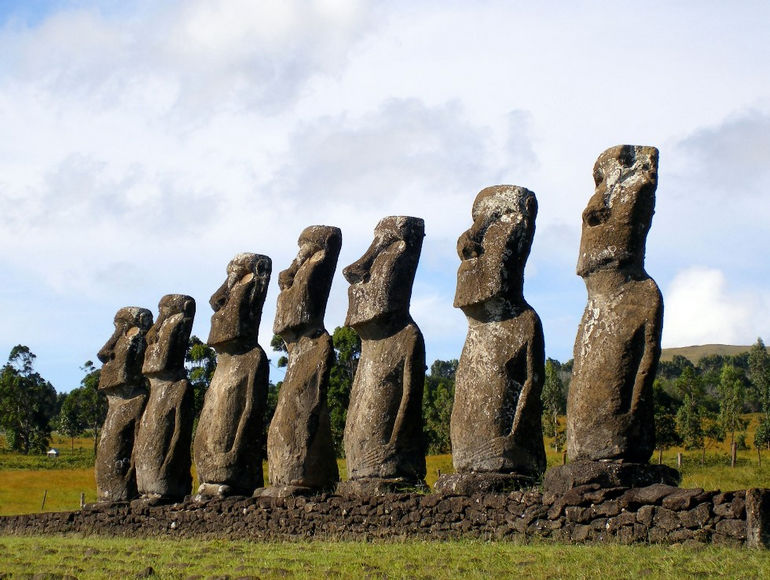
You are a GUI agent. You are given a task and a screenshot of the screen. Output one action in this format:
    pyautogui.click(x=<x>, y=<y>)
    Task: Click on the statue
    The image size is (770, 580).
    Given the screenshot: What is the action you would take?
    pyautogui.click(x=618, y=347), pyautogui.click(x=477, y=375), pyautogui.click(x=367, y=380), pyautogui.click(x=288, y=398), pyautogui.click(x=218, y=403), pyautogui.click(x=149, y=429), pyautogui.click(x=105, y=437)